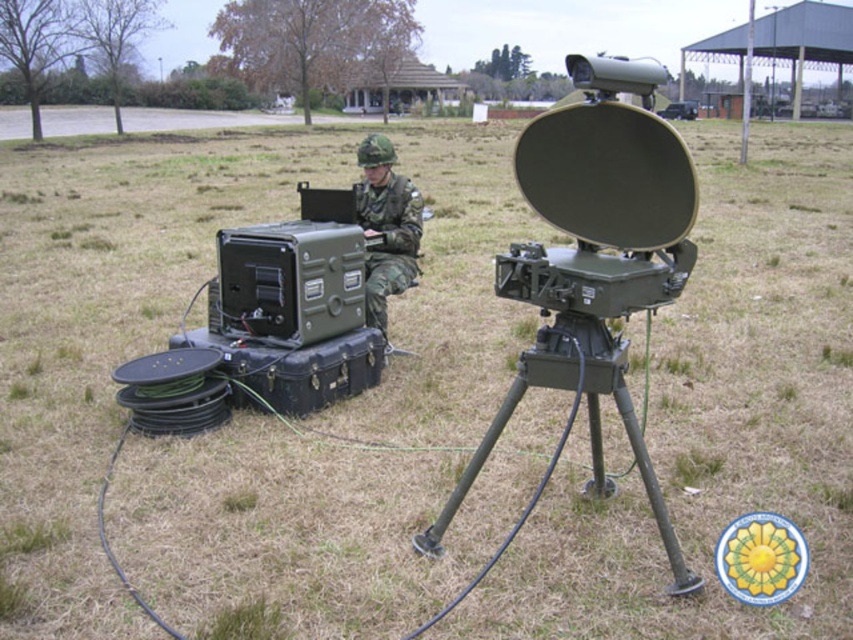
You are a technician standing at the camera position. You need to reach the point marked at coordinates [608,371]. Can you safely walk directly to that point without encountering any obstacles?

The point marked at coordinates [608,371] is 9.03 feet away from the camera. Since there are no obstacles mentioned between the camera and the point, you can safely walk directly to that point.

You are a soldier in the field and need to adjust the green matte tripod at center. However, the camouflage fabric uniform at center is blocking your path. Can you reach the tripod without moving the uniform?

The green matte tripod at center is closer to the viewer than the camouflage fabric uniform at center, so you can reach the tripod without moving the uniform as it is in front of the uniform.

You are a military technician who needs to determine if the green matte tripod at center can be stored inside the camouflage fabric uniform at center. Based on their sizes, is this feasible?

The green matte tripod at center is not as tall as the camouflage fabric uniform at center, so it is possible to store the green matte tripod at center inside the camouflage fabric uniform at center.